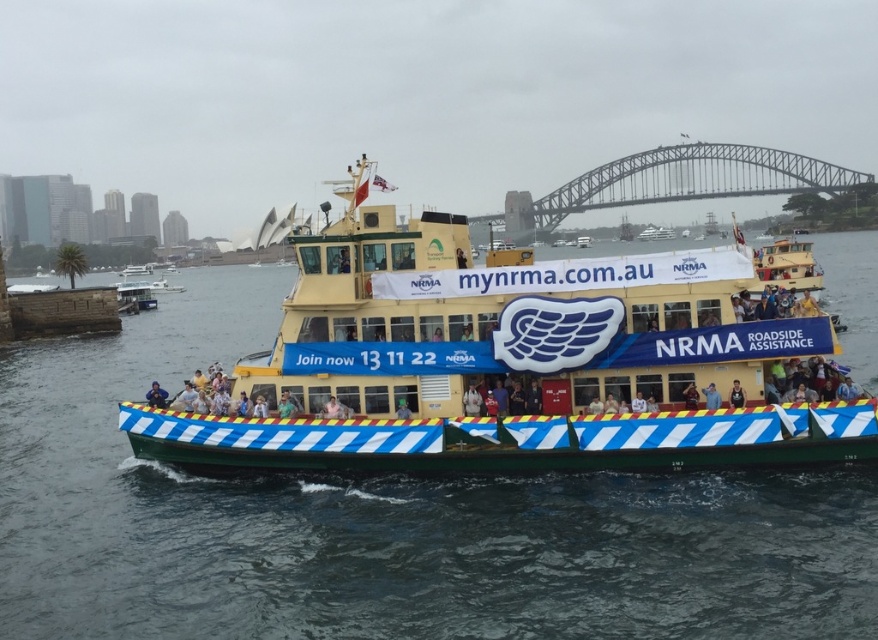
You are a photographer standing on the deck of the yellow ferry boat near the NRMA banners. You want to take a photo of the metallic steel bridge at upper center. Your camera has a zoom lens that can focus on objects up to 600 feet away. Will you be able to capture the bridge clearly without moving closer?

The metallic steel bridge at upper center and camera are 580.86 feet apart from each other. Since the camera can focus up to 600 feet, you can capture the bridge clearly without moving closer.

You are standing on a nearby pier and want to take a photo of the yellow painted wood ferry at center. If your camera can focus on objects up to 50 meters away, will you be able to capture a clear image of the ferry?

The distance between you and the yellow painted wood ferry at center is 43.03 meters, which is within the camera focus range of 50 meters. Therefore, you can capture a clear image of the ferry.

You are a photographer taking a picture of the yellow painted wood ferry at center and the dark blue fabric at center. Based on their positions in the image, which object is closer to the camera?

The yellow painted wood ferry at center is closer to the camera because it is positioned above the dark blue fabric at center, indicating it is in front of it.